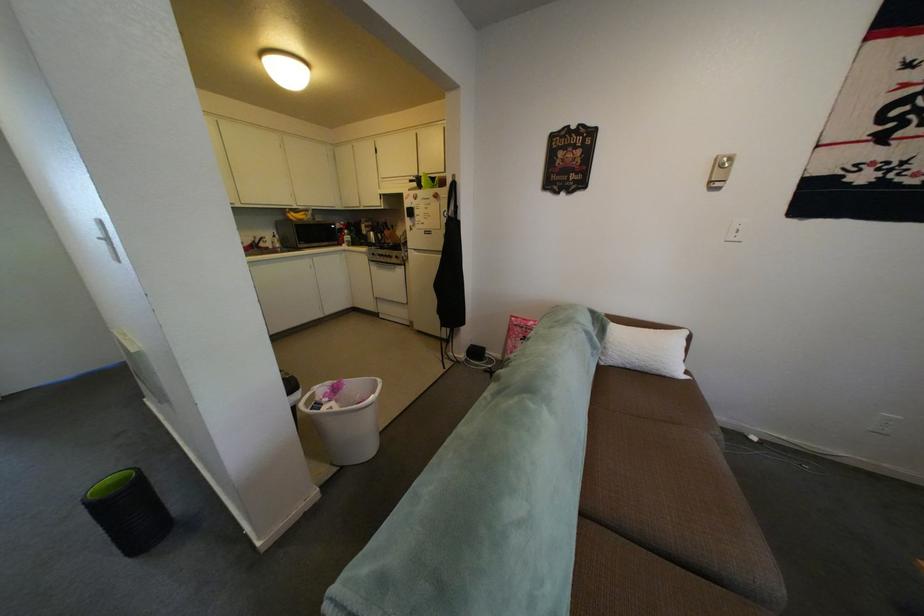
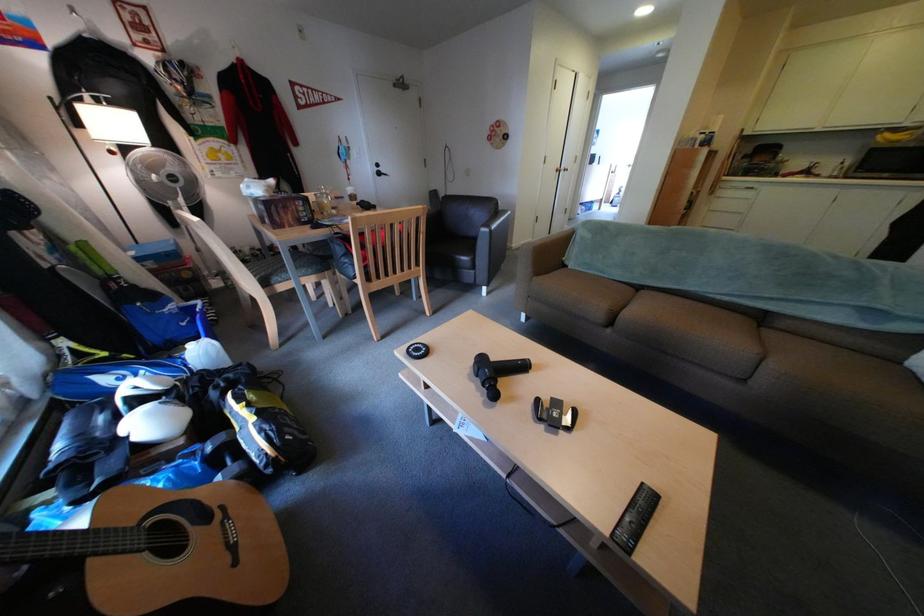
Find the pixel in the second image that matches the point at 304,216 in the first image.

(894, 138)